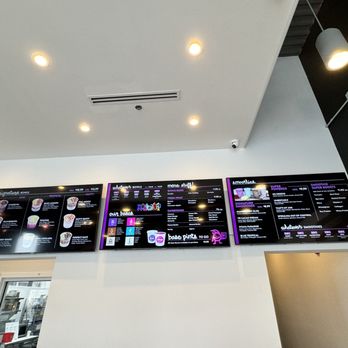
In order to click on white wall in this screenshot , I will do `click(110, 308)`.